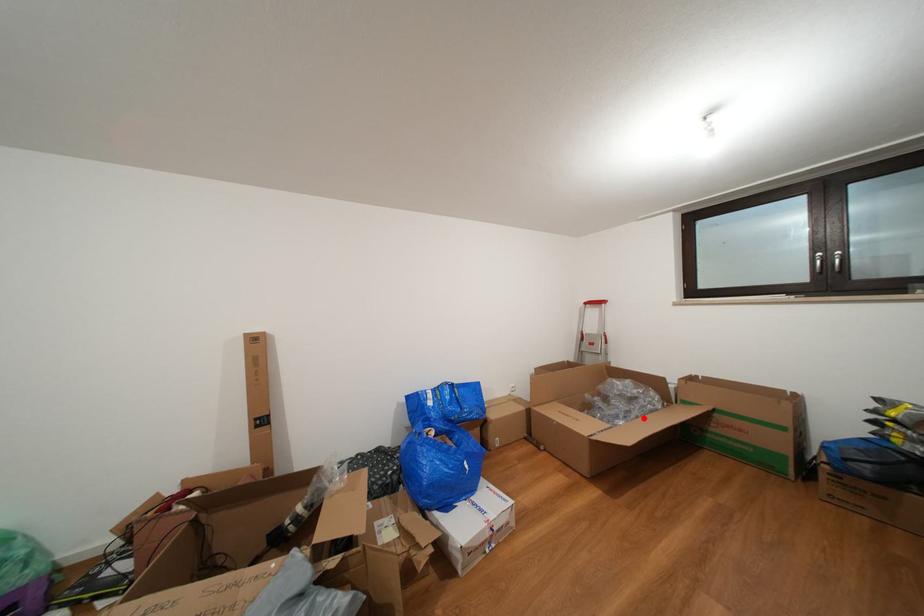
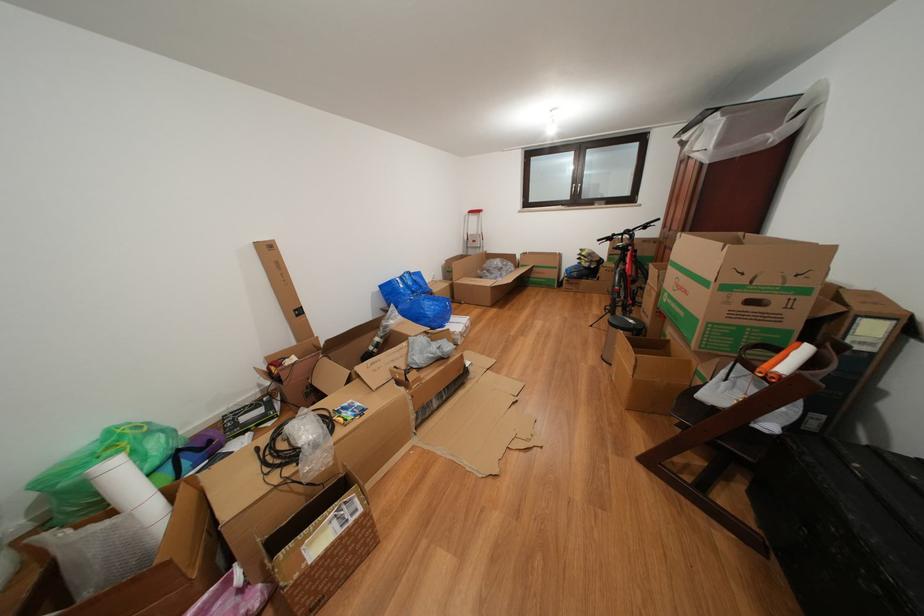
Question: A red point is marked in image1. In image2, is the corresponding 3D point closer to the camera or farther? Reply with the corresponding letter.

Choices:
 (A) The corresponding 3D point is closer.
 (B) The corresponding 3D point is farther.

Answer: (A)